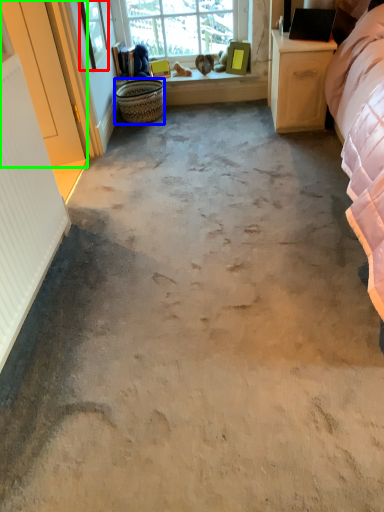
Question: Which object is positioned farthest from window screen (highlighted by a red box)? Select from basket (highlighted by a blue box) and screen door (highlighted by a green box).

Choices:
 (A) basket
 (B) screen door

Answer: (B)